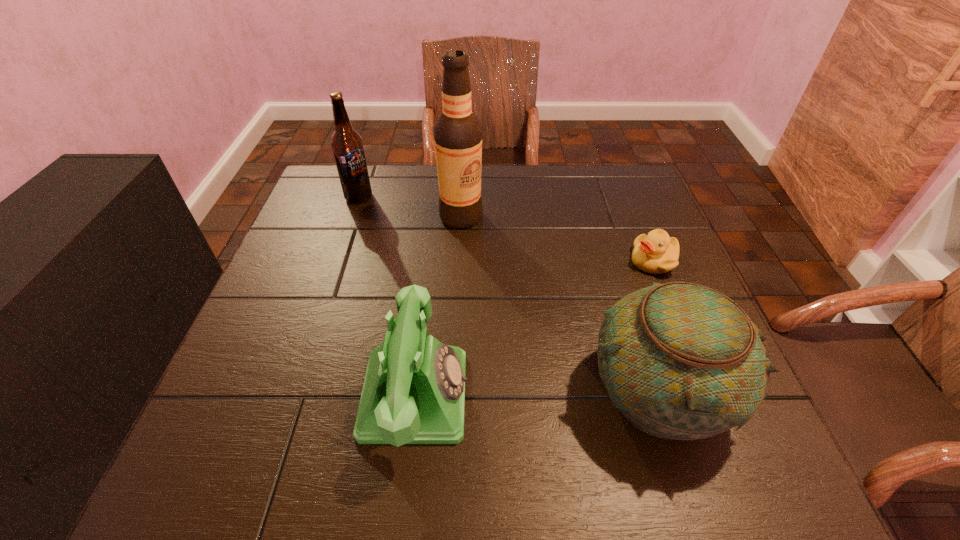
Where is `vacant space at the right edge`? vacant space at the right edge is located at coordinates click(x=623, y=242).

Locate an element on the screen. free area in between the tallest object and the second tallest object is located at coordinates (410, 207).

You are a GUI agent. You are given a task and a screenshot of the screen. Output one action in this format:
    pyautogui.click(x=<x>, y=<y>)
    Task: Click on the free space that is in between the shortest object and the second shortest object
    This screenshot has width=960, height=540.
    Given the screenshot: What is the action you would take?
    pyautogui.click(x=535, y=328)

Where is `vacant space that is in between the pottery and the alcohol`? The height and width of the screenshot is (540, 960). vacant space that is in between the pottery and the alcohol is located at coordinates (560, 303).

The width and height of the screenshot is (960, 540). What are the coordinates of `empty space that is in between the tallest object and the telephone` in the screenshot? It's located at (438, 306).

I want to click on free point between the beer bottle and the pottery, so 508,293.

Identify the location of free space between the leftmost object and the pottery. Image resolution: width=960 pixels, height=540 pixels. (508, 293).

Locate an element on the screen. The image size is (960, 540). free space that is in between the beer bottle and the pottery is located at coordinates [508, 293].

Where is `vacant area between the alcohol and the pottery`? vacant area between the alcohol and the pottery is located at coordinates (560, 303).

The height and width of the screenshot is (540, 960). Find the location of `object that is the third nearest to the fourth tallest object`. object that is the third nearest to the fourth tallest object is located at coordinates (655, 253).